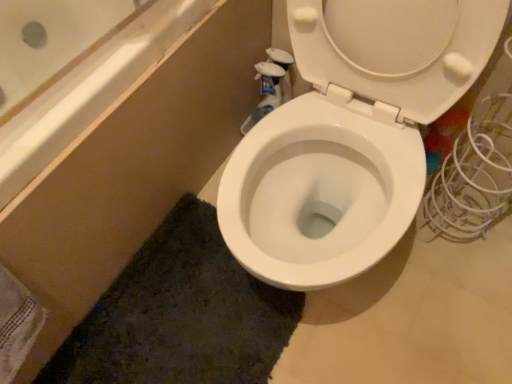
Question: From a real-world perspective, is white glossy toilet at center over dark green textured bath mat at lower center?

Choices:
 (A) no
 (B) yes

Answer: (B)

Question: Is white glossy toilet at center bigger than dark green textured bath mat at lower center?

Choices:
 (A) no
 (B) yes

Answer: (B)

Question: From the image's perspective, would you say white glossy toilet at center is shown under dark green textured bath mat at lower center?

Choices:
 (A) no
 (B) yes

Answer: (A)

Question: Could you tell me if white glossy toilet at center is turned towards dark green textured bath mat at lower center?

Choices:
 (A) no
 (B) yes

Answer: (B)

Question: Considering the relative positions of white glossy toilet at center and dark green textured bath mat at lower center in the image provided, is white glossy toilet at center to the left of dark green textured bath mat at lower center from the viewer's perspective?

Choices:
 (A) no
 (B) yes

Answer: (A)

Question: Would you say dark green textured bath mat at lower center is to the left or to the right of white glossy toilet at center in the picture?

Choices:
 (A) left
 (B) right

Answer: (A)

Question: Is dark green textured bath mat at lower center spatially inside white glossy toilet at center, or outside of it?

Choices:
 (A) inside
 (B) outside

Answer: (B)

Question: From the image's perspective, relative to white glossy toilet at center, is dark green textured bath mat at lower center above or below?

Choices:
 (A) below
 (B) above

Answer: (A)

Question: Considering the positions of dark green textured bath mat at lower center and white glossy toilet at center in the image, is dark green textured bath mat at lower center taller or shorter than white glossy toilet at center?

Choices:
 (A) short
 (B) tall

Answer: (A)

Question: Looking at the image, does white glossy toilet at center seem bigger or smaller compared to white textured towel at lower left?

Choices:
 (A) big
 (B) small

Answer: (A)

Question: Relative to white textured towel at lower left, is white glossy toilet at center in front or behind?

Choices:
 (A) behind
 (B) front

Answer: (B)

Question: Is point (330, 147) closer or farther from the camera than point (14, 365)?

Choices:
 (A) farther
 (B) closer

Answer: (A)

Question: Based on their positions, is white glossy toilet at center located to the left or right of white textured towel at lower left?

Choices:
 (A) right
 (B) left

Answer: (A)

Question: Is dark green textured bath mat at lower center taller or shorter than white textured towel at lower left?

Choices:
 (A) tall
 (B) short

Answer: (B)

Question: Considering the positions of dark green textured bath mat at lower center and white textured towel at lower left in the image, is dark green textured bath mat at lower center bigger or smaller than white textured towel at lower left?

Choices:
 (A) big
 (B) small

Answer: (A)